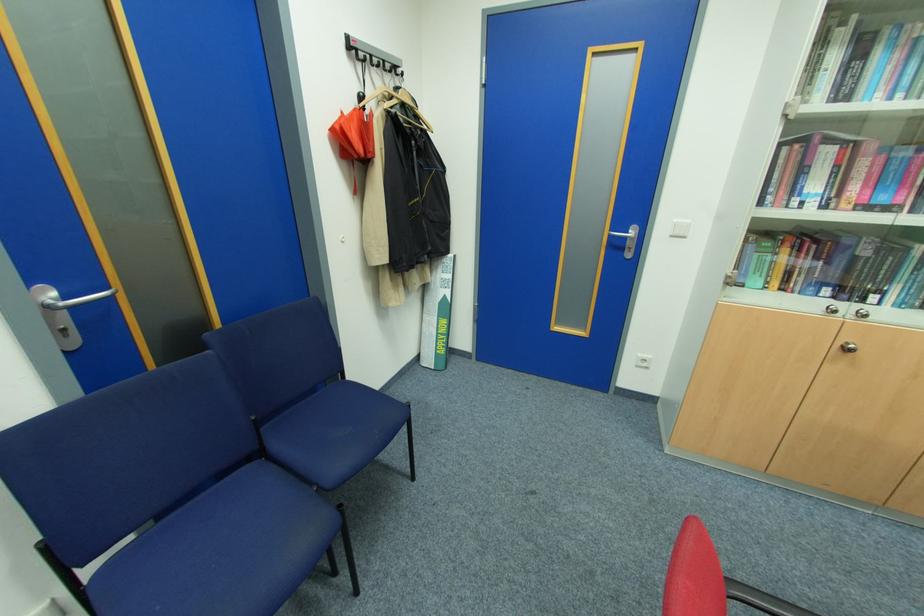
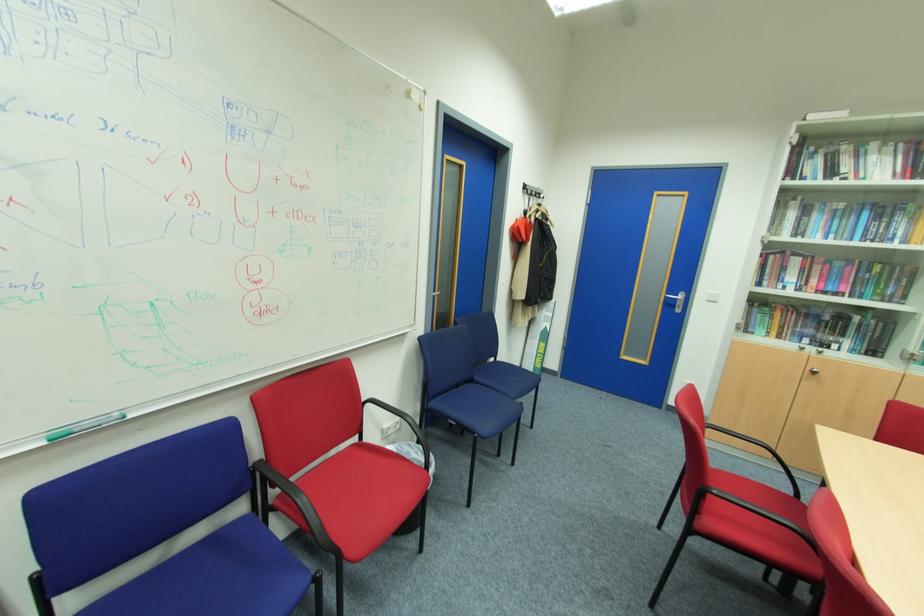
In the second image, find the point that corresponds to the point at 675,236 in the first image.

(711, 301)